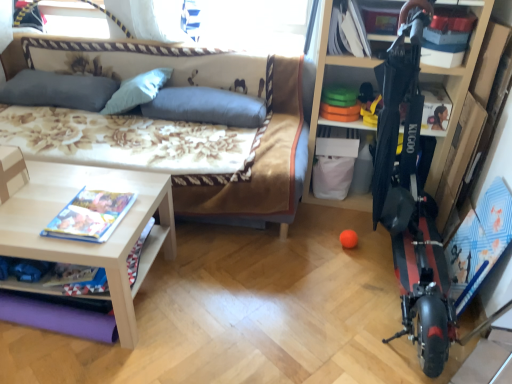
Identify the location of empty space that is ontop of hardcover book at lower left, positioned as the second book in right-to-left order (from a real-world perspective). (90, 214).